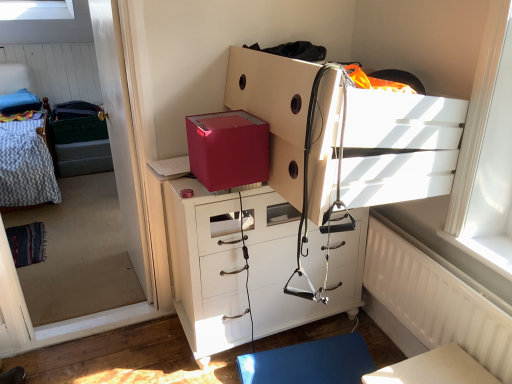
Question: Can you confirm if matte white chest of drawers at center, positioned as the first chest of drawers in top-to-bottom order, is smaller than transparent glass window screen at left?

Choices:
 (A) no
 (B) yes

Answer: (A)

Question: From a real-world perspective, is matte white chest of drawers at center, positioned as the first chest of drawers in top-to-bottom order, on transparent glass window screen at left?

Choices:
 (A) no
 (B) yes

Answer: (B)

Question: Considering the relative positions of matte white chest of drawers at center, positioned as the first chest of drawers in top-to-bottom order, and transparent glass window screen at left in the image provided, is matte white chest of drawers at center, positioned as the first chest of drawers in top-to-bottom order, to the right of transparent glass window screen at left from the viewer's perspective?

Choices:
 (A) yes
 (B) no

Answer: (A)

Question: Does matte white chest of drawers at center, positioned as the first chest of drawers in top-to-bottom order, have a larger size compared to transparent glass window screen at left?

Choices:
 (A) yes
 (B) no

Answer: (A)

Question: From the image's perspective, is matte white chest of drawers at center, positioned as the first chest of drawers in top-to-bottom order, over transparent glass window screen at left?

Choices:
 (A) no
 (B) yes

Answer: (B)

Question: From a real-world perspective, is matte white chest of drawers at center, positioned as the first chest of drawers in top-to-bottom order, under transparent glass window screen at left?

Choices:
 (A) no
 (B) yes

Answer: (A)

Question: Is the position of white glossy table at lower right more distant than that of white textured radiator at lower right?

Choices:
 (A) no
 (B) yes

Answer: (A)

Question: From the image's perspective, is white glossy table at lower right over white textured radiator at lower right?

Choices:
 (A) no
 (B) yes

Answer: (A)

Question: Is the surface of white glossy table at lower right in direct contact with white textured radiator at lower right?

Choices:
 (A) no
 (B) yes

Answer: (A)

Question: From a real-world perspective, is white glossy table at lower right located beneath white textured radiator at lower right?

Choices:
 (A) no
 (B) yes

Answer: (B)

Question: From a real-world perspective, is white glossy table at lower right over white textured radiator at lower right?

Choices:
 (A) yes
 (B) no

Answer: (B)

Question: Are white glossy table at lower right and white textured radiator at lower right located far from each other?

Choices:
 (A) no
 (B) yes

Answer: (A)

Question: Is white glossy chest of drawers at center, positioned as the second chest of drawers in top-to-bottom order, oriented away from matte white chest of drawers at center, which is the 2th chest of drawers from bottom to top?

Choices:
 (A) no
 (B) yes

Answer: (A)